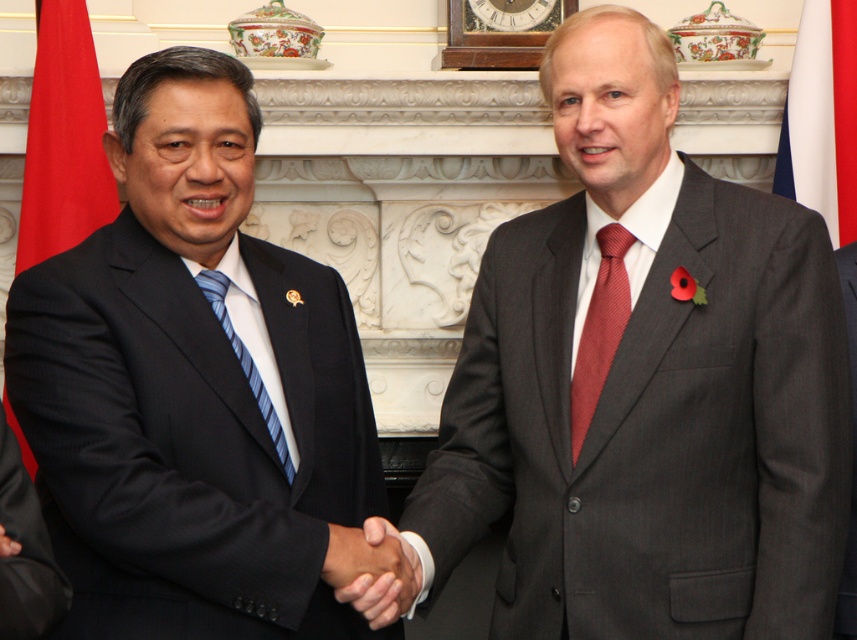
Who is positioned more to the right, red fabric flag at left or blue striped tie at center?

From the viewer's perspective, blue striped tie at center appears more on the right side.

Does point (76, 112) come farther from viewer compared to point (274, 444)?

Yes, point (76, 112) is farther from viewer.

You are a GUI agent. You are given a task and a screenshot of the screen. Output one action in this format:
    pyautogui.click(x=<x>, y=<y>)
    Task: Click on the red fabric flag at left
    
    Given the screenshot: What is the action you would take?
    pyautogui.click(x=63, y=140)

What do you see at coordinates (822, 116) in the screenshot?
I see `white fabric flag at right` at bounding box center [822, 116].

Looking at this image, is white fabric flag at right in front of red silk tie at center?

No, it is behind red silk tie at center.

At what (x,y) coordinates should I click in order to perform the action: click on white fabric flag at right. Please return your answer as a coordinate pair (x, y). The image size is (857, 640). Looking at the image, I should click on (822, 116).

Locate an element on the screen. This screenshot has width=857, height=640. black matte suit at left is located at coordinates (192, 387).

At what (x,y) coordinates should I click in order to perform the action: click on black matte suit at left. Please return your answer as a coordinate pair (x, y). Looking at the image, I should click on (192, 387).